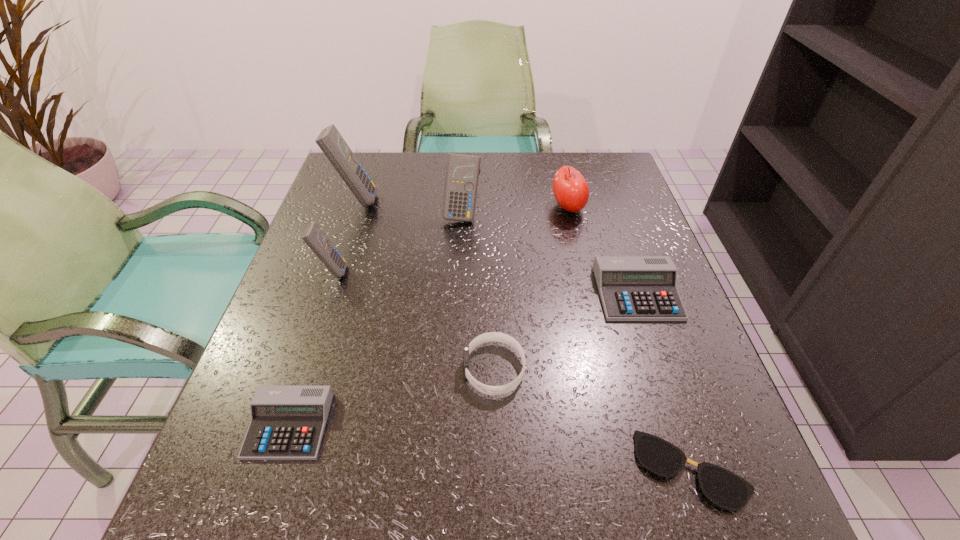
In order to click on calculator that is the closest to the wristband in this screenshot , I will do `click(632, 288)`.

The height and width of the screenshot is (540, 960). In order to click on the third closest blue calculator to the bigger gray calculator in this screenshot , I will do `click(330, 141)`.

Locate an element on the screen. blue calculator that is the third closest to the wristband is located at coordinates (330, 141).

The image size is (960, 540). I want to click on vacant region that satisfies the following two spatial constraints: 1. on the front-facing side of the nearest calculator; 2. on the left side of the third shortest calculator, so click(279, 426).

At what (x,y) coordinates should I click in order to perform the action: click on free space in the image that satisfies the following two spatial constraints: 1. on the front side of the apple; 2. on the right side of the second shortest calculator. Please return your answer as a coordinate pair (x, y). Looking at the image, I should click on (588, 293).

This screenshot has width=960, height=540. I want to click on vacant position in the image that satisfies the following two spatial constraints: 1. on the outer surface of the wristband; 2. on the left side of the spectacles, so click(497, 469).

At what (x,y) coordinates should I click in order to perform the action: click on free point that satisfies the following two spatial constraints: 1. on the front-facing side of the third shortest calculator; 2. on the back side of the shortest calculator. Please return your answer as a coordinate pair (x, y). Looking at the image, I should click on (279, 426).

This screenshot has width=960, height=540. Find the location of `vacant space that satisfies the following two spatial constraints: 1. on the back side of the spectacles; 2. on the front-facing side of the tallest object`. vacant space that satisfies the following two spatial constraints: 1. on the back side of the spectacles; 2. on the front-facing side of the tallest object is located at coordinates (602, 200).

Identify the location of free spot that satisfies the following two spatial constraints: 1. on the front-facing side of the shortest object; 2. on the left side of the second smallest blue calculator. (450, 469).

This screenshot has width=960, height=540. Find the location of `vacant space that satisfies the following two spatial constraints: 1. on the outer surface of the wristband; 2. on the front side of the nearest calculator`. vacant space that satisfies the following two spatial constraints: 1. on the outer surface of the wristband; 2. on the front side of the nearest calculator is located at coordinates (496, 426).